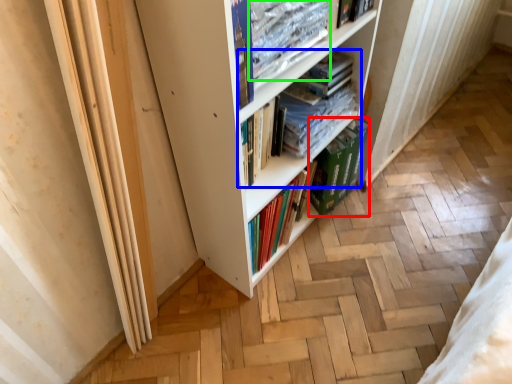
Question: Which is farther away from paperback book (highlighted by a red box)? book (highlighted by a blue box) or book (highlighted by a green box)?

Choices:
 (A) book
 (B) book

Answer: (B)